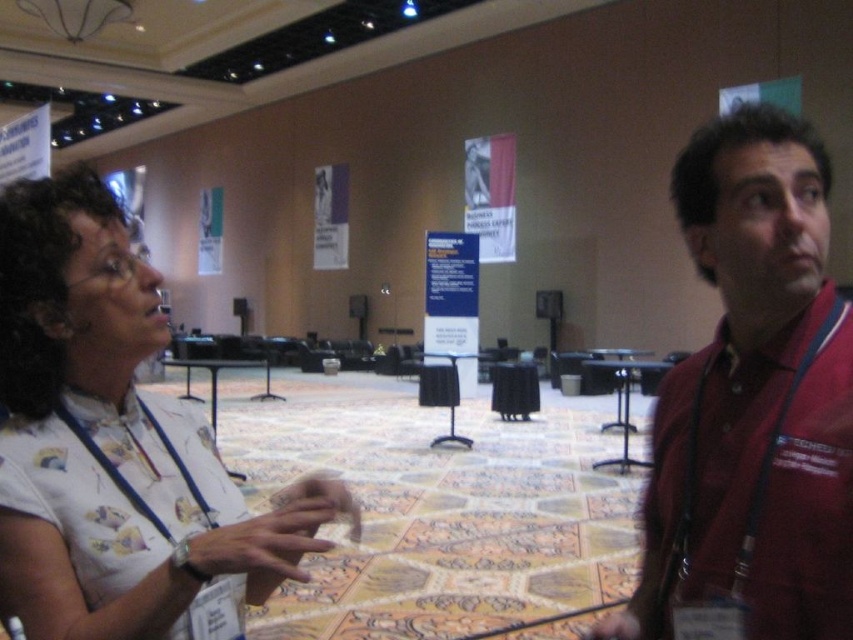
Question: Is white printed shirt at left closer to the viewer compared to maroon fabric shirt at right?

Choices:
 (A) yes
 (B) no

Answer: (A)

Question: Can you confirm if white printed shirt at left is positioned to the left of maroon fabric shirt at right?

Choices:
 (A) yes
 (B) no

Answer: (A)

Question: Which point is closer to the camera?

Choices:
 (A) (790, 241)
 (B) (160, 499)

Answer: (A)

Question: Does white printed shirt at left come in front of maroon fabric shirt at right?

Choices:
 (A) yes
 (B) no

Answer: (A)